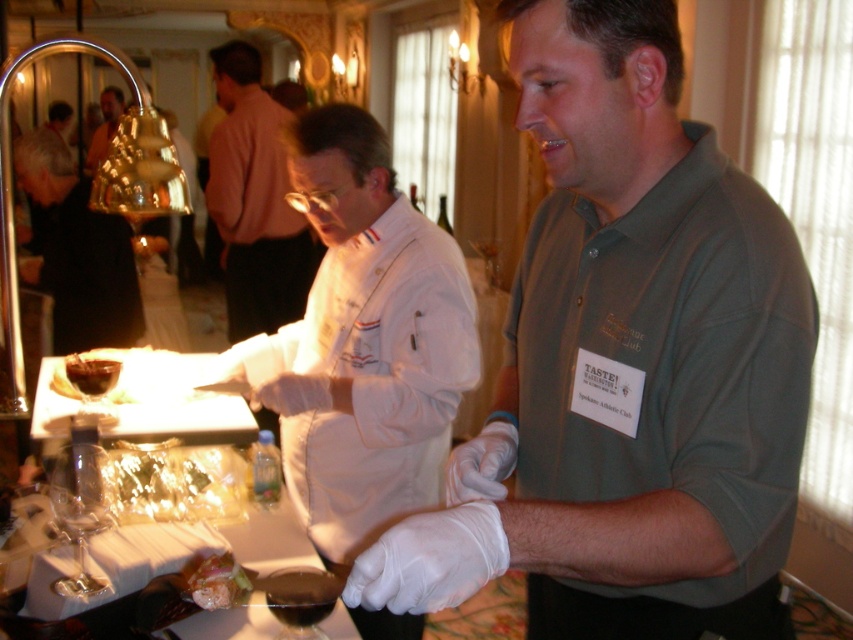
You are organizing a food tasting event and need to place a decorative tablecloth that is 1.2 meters wide on the table. The table currently has a white chef coat at center and a black fabric at left. Which object on the table has enough width to accommodate the tablecloth without overlapping?

The black fabric at left has a greater width than the white chef coat at center, so it can accommodate the 1.2 meter wide tablecloth without overlapping.

You are a guest at the event and want to approach the chef preparing food. Which object, the white chef coat at center or the black fabric at left, is closer to you as you walk towards the table?

The white chef coat at center is closer to you because the black fabric at left is behind it.

What object is located at the coordinates point [254,202]?

The point [254,202] corresponds to the white chef coat at center.